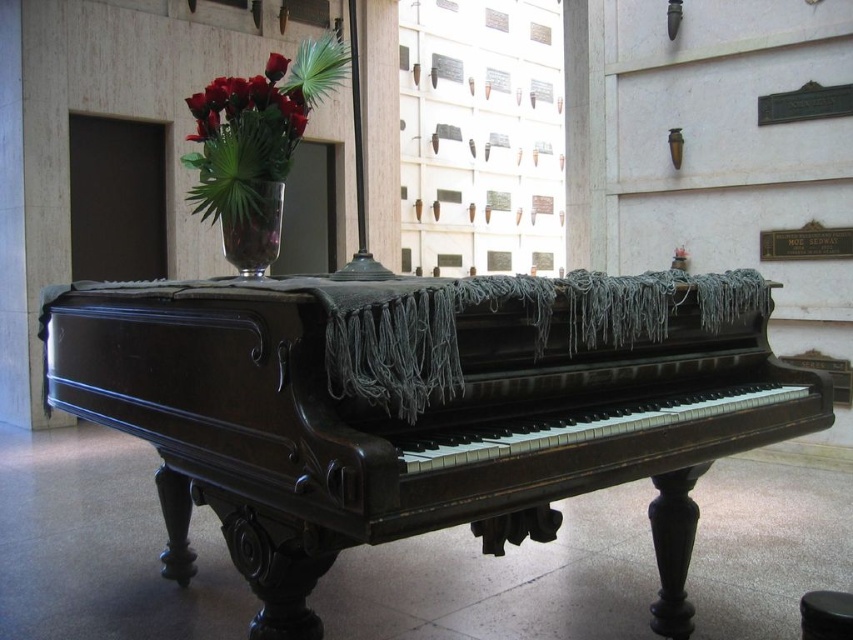
Question: Which point is farther from the camera taking this photo?

Choices:
 (A) (279, 54)
 (B) (540, 524)

Answer: (A)

Question: Does shiny glass vase with roses at upper left have a larger size compared to clear glass vase at upper center?

Choices:
 (A) yes
 (B) no

Answer: (A)

Question: Estimate the real-world distances between objects in this image. Which object is closer to the shiny glass vase with roses at upper left?

Choices:
 (A) polished dark wood piano at center
 (B) matte glass vase at upper center
 (C) clear glass vase at upper center

Answer: (C)

Question: Considering the relative positions of polished dark wood piano at center and shiny glass vase with roses at upper left in the image provided, where is polished dark wood piano at center located with respect to shiny glass vase with roses at upper left?

Choices:
 (A) left
 (B) right

Answer: (B)

Question: Does clear glass vase at upper center appear under matte glass vase at upper center?

Choices:
 (A) yes
 (B) no

Answer: (A)

Question: Which point is closer to the camera?

Choices:
 (A) (265, 76)
 (B) (355, 493)
 (C) (225, 230)

Answer: (B)